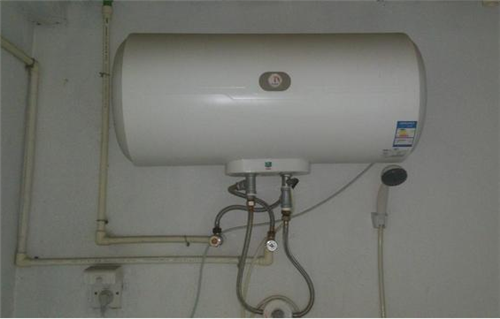
Where is `plug`? The height and width of the screenshot is (319, 500). plug is located at coordinates (102, 302).